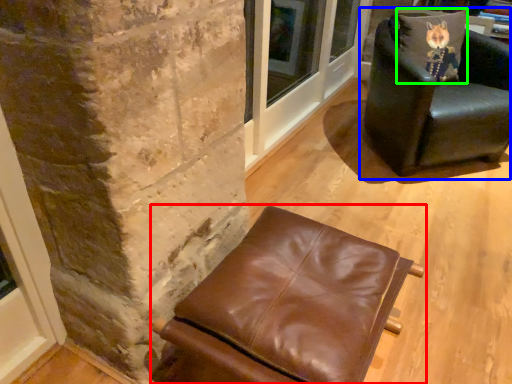
Question: Considering the real-world distances, which object is closest to chair (highlighted by a red box)? chair (highlighted by a blue box) or pillow (highlighted by a green box).

Choices:
 (A) chair
 (B) pillow

Answer: (A)